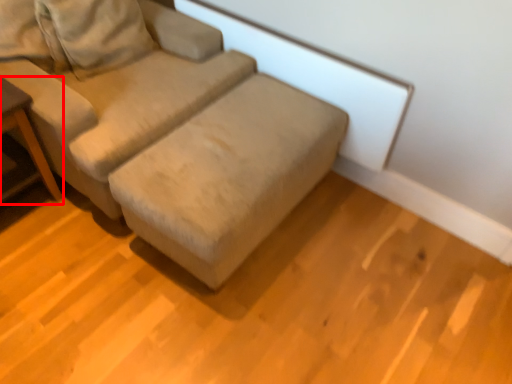
Question: Where is table (annotated by the red box) located in relation to studio couch in the image?

Choices:
 (A) left
 (B) right

Answer: (A)